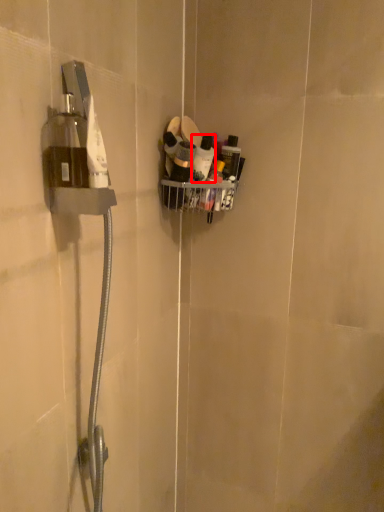
Question: In this image, where is toiletry (annotated by the red box) located relative to toiletry?

Choices:
 (A) right
 (B) left

Answer: (A)